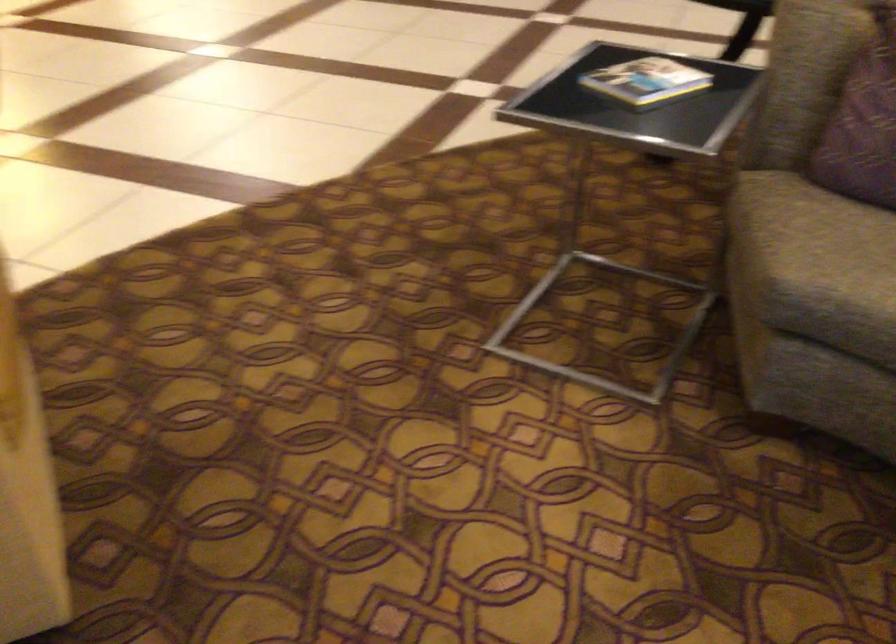
What do you see at coordinates (822, 234) in the screenshot? I see `the sofa sitting surface` at bounding box center [822, 234].